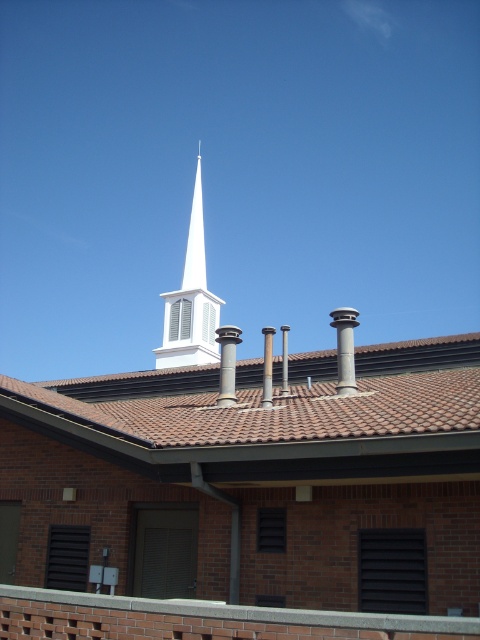
You are an architect reviewing a building design. The point at coordinates (191, 301) is part of which structure in the image? Please answer using the object labels from the scene description.

The point at coordinates (191, 301) is on the white smooth steeple at upper center.

You are standing on the ground looking at the building. Which object, the white smooth steeple at upper center or the slate gray stone chimney at center, is closer to you?

The white smooth steeple at upper center is closer to you because the slate gray stone chimney at center is behind it.

You are an architect reviewing the building design. You notice the white smooth steeple at upper center and the slate gray chimney at upper center. Which of these two structures is taller?

The white smooth steeple at upper center is much taller than the slate gray chimney at upper center.